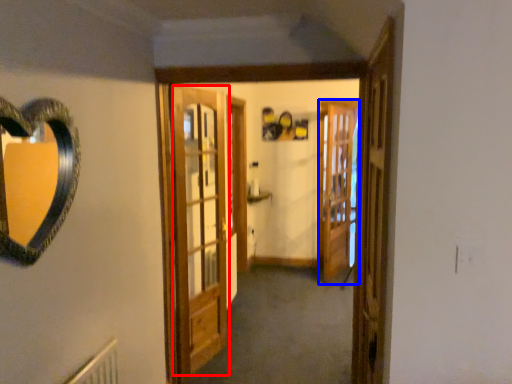
Question: Which object appears closest to the camera in this image, barn door (highlighted by a red box) or screen door (highlighted by a blue box)?

Choices:
 (A) barn door
 (B) screen door

Answer: (A)